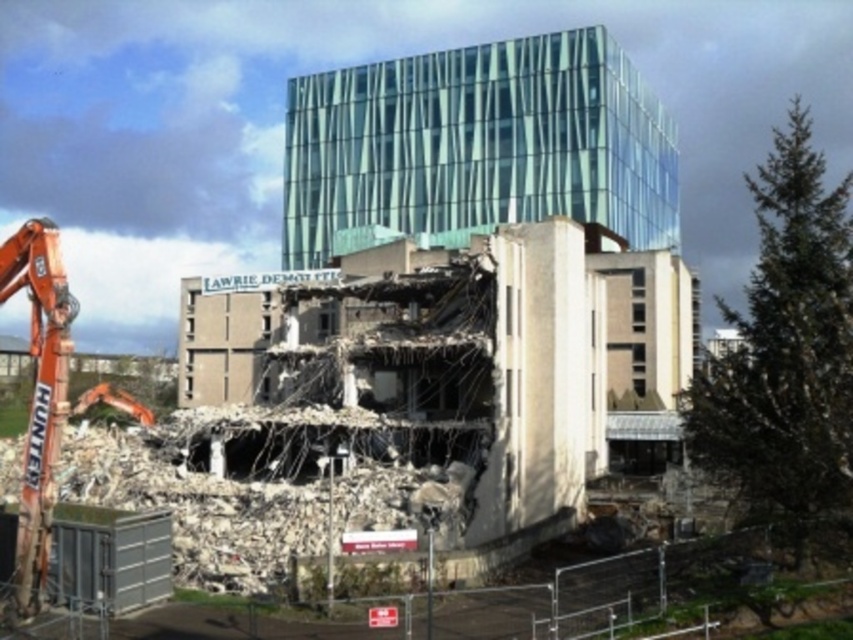
Who is more forward, (193,545) or (57,369)?

Point (57,369) is in front.

Locate an element on the screen. Image resolution: width=853 pixels, height=640 pixels. crumbled concrete debris at lower left is located at coordinates (199, 509).

In the scene shown: How far apart are transparent glass building at upper center and crumbled concrete debris at lower left?

235.29 feet

Does transparent glass building at upper center have a smaller size compared to crumbled concrete debris at lower left?

No.

Who is more forward, (344, 83) or (134, 481)?

Point (134, 481) is in front.

Locate an element on the screen. transparent glass building at upper center is located at coordinates click(479, 145).

Which is behind, point (352, 67) or point (35, 554)?

The point (352, 67) is more distant.

Does point (505, 180) come closer to viewer compared to point (42, 280)?

No, it is not.

Between point (523, 173) and point (7, 285), which one is positioned behind?

The point (523, 173) is behind.

This screenshot has width=853, height=640. I want to click on transparent glass building at upper center, so click(479, 145).